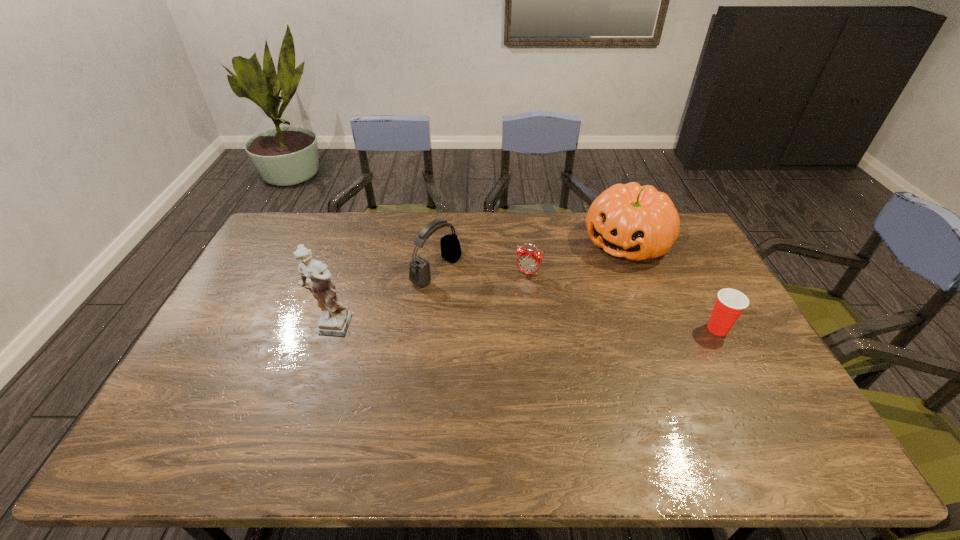
Where is `object at the far right corner`? object at the far right corner is located at coordinates (636, 222).

Identify the location of vacant space at the far edge. 313,246.

In the image, there is a desktop. Identify the location of vacant space at the near edge. coord(548,404).

Where is `vacant space at the left edge of the desktop`? This screenshot has width=960, height=540. vacant space at the left edge of the desktop is located at coordinates (236, 310).

Identify the location of free space at the right edge of the desktop. (710, 271).

The image size is (960, 540). In order to click on vacant space at the far left corner of the desktop in this screenshot , I will do `click(306, 225)`.

Locate an element on the screen. This screenshot has width=960, height=540. vacant area that lies between the leftmost object and the third object from left to right is located at coordinates (429, 301).

The width and height of the screenshot is (960, 540). Identify the location of free space between the headset and the Dixie cup. (577, 300).

You are a GUI agent. You are given a task and a screenshot of the screen. Output one action in this format:
    pyautogui.click(x=<x>, y=<y>)
    Task: Click on the vacant region between the Dixie cup and the alarm clock
    
    Given the screenshot: What is the action you would take?
    pyautogui.click(x=623, y=301)

Where is `vacant space that's between the Dixie cup and the third object from left to right`? Image resolution: width=960 pixels, height=540 pixels. vacant space that's between the Dixie cup and the third object from left to right is located at coordinates (623, 301).